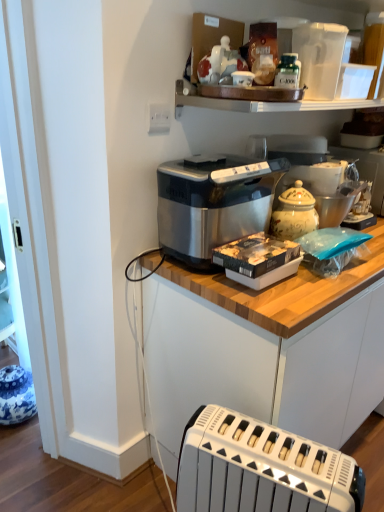
Question: Does satin silver toaster at center appear on the left side of green glass bottle at upper center?

Choices:
 (A) yes
 (B) no

Answer: (B)

Question: From the image's perspective, does satin silver toaster at center appear lower than green glass bottle at upper center?

Choices:
 (A) no
 (B) yes

Answer: (B)

Question: Would you say satin silver toaster at center is outside green glass bottle at upper center?

Choices:
 (A) no
 (B) yes

Answer: (B)

Question: Is green glass bottle at upper center surrounded by satin silver toaster at center?

Choices:
 (A) yes
 (B) no

Answer: (B)

Question: Is satin silver toaster at center looking in the opposite direction of green glass bottle at upper center?

Choices:
 (A) no
 (B) yes

Answer: (A)

Question: In the image, is white plastic toaster at lower center positioned in front of or behind blue and white ceramic vase at lower left, acting as the third appliance starting from the right?

Choices:
 (A) front
 (B) behind

Answer: (A)

Question: Which is correct: white plastic toaster at lower center is inside blue and white ceramic vase at lower left, acting as the third appliance starting from the right, or outside of it?

Choices:
 (A) inside
 (B) outside

Answer: (B)

Question: In terms of width, does white plastic toaster at lower center look wider or thinner when compared to blue and white ceramic vase at lower left, acting as the third appliance starting from the top?

Choices:
 (A) thin
 (B) wide

Answer: (B)

Question: Does point (228, 478) appear closer or farther from the camera than point (34, 397)?

Choices:
 (A) farther
 (B) closer

Answer: (B)

Question: Looking at their shapes, would you say green glass bottle at upper center is wider or thinner than satin silver toaster at center?

Choices:
 (A) wide
 (B) thin

Answer: (B)

Question: From a real-world perspective, is green glass bottle at upper center above or below satin silver toaster at center?

Choices:
 (A) below
 (B) above

Answer: (B)

Question: Considering the positions of point (291, 57) and point (360, 409), is point (291, 57) closer or farther from the camera than point (360, 409)?

Choices:
 (A) farther
 (B) closer

Answer: (B)

Question: From the image's perspective, relative to satin silver toaster at center, is green glass bottle at upper center above or below?

Choices:
 (A) above
 (B) below

Answer: (A)

Question: In the image, is satin silver toaster at center positioned in front of or behind green glass bottle at upper center?

Choices:
 (A) front
 (B) behind

Answer: (A)

Question: From a real-world perspective, is satin silver toaster at center physically located above or below green glass bottle at upper center?

Choices:
 (A) above
 (B) below

Answer: (B)